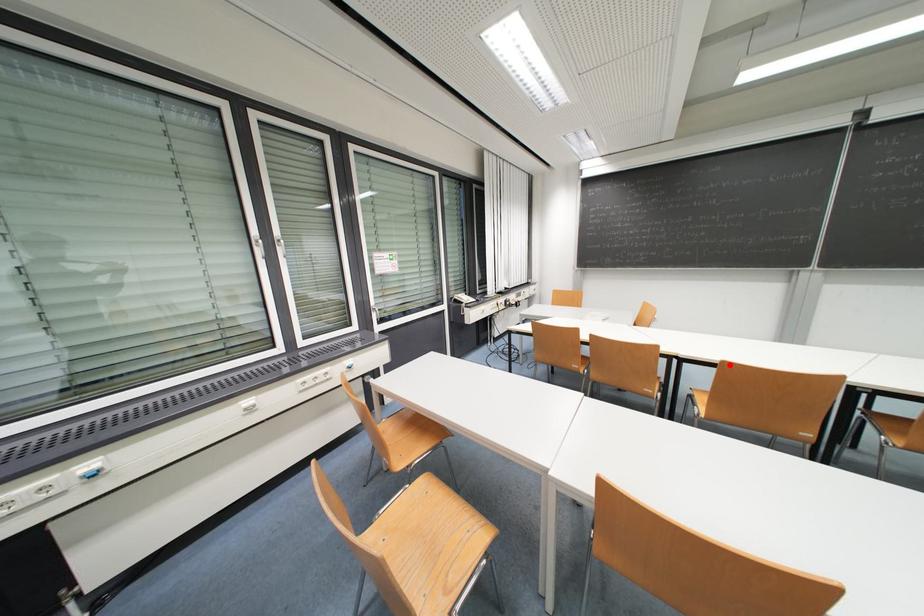
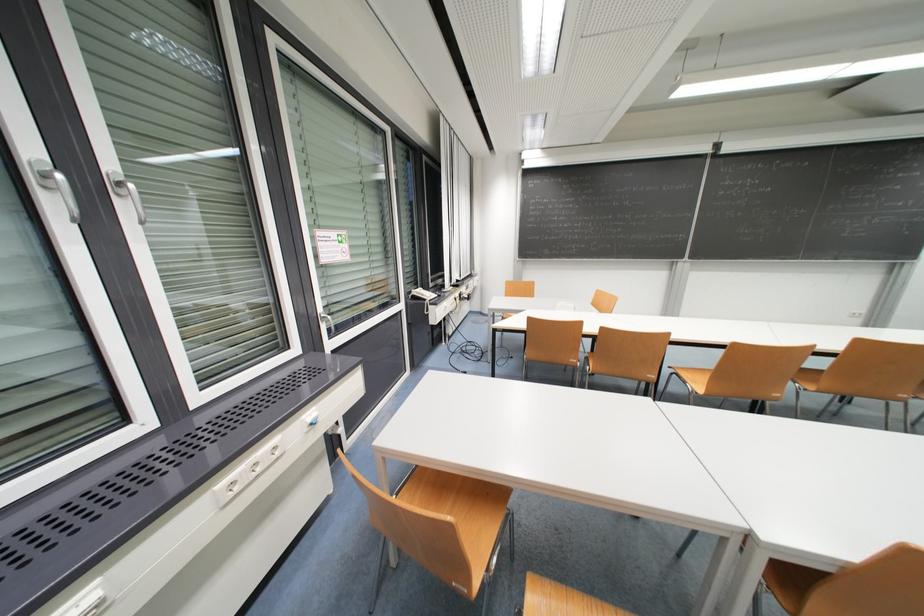
Locate, in the second image, the point that corresponds to the highlighted location in the first image.

(739, 346)